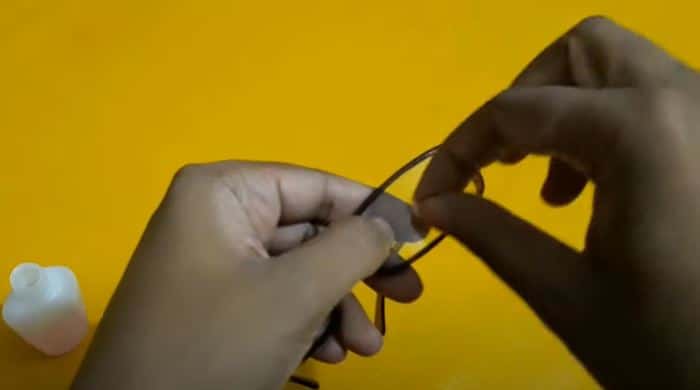
The width and height of the screenshot is (700, 390). I want to click on bottle, so click(x=32, y=301).